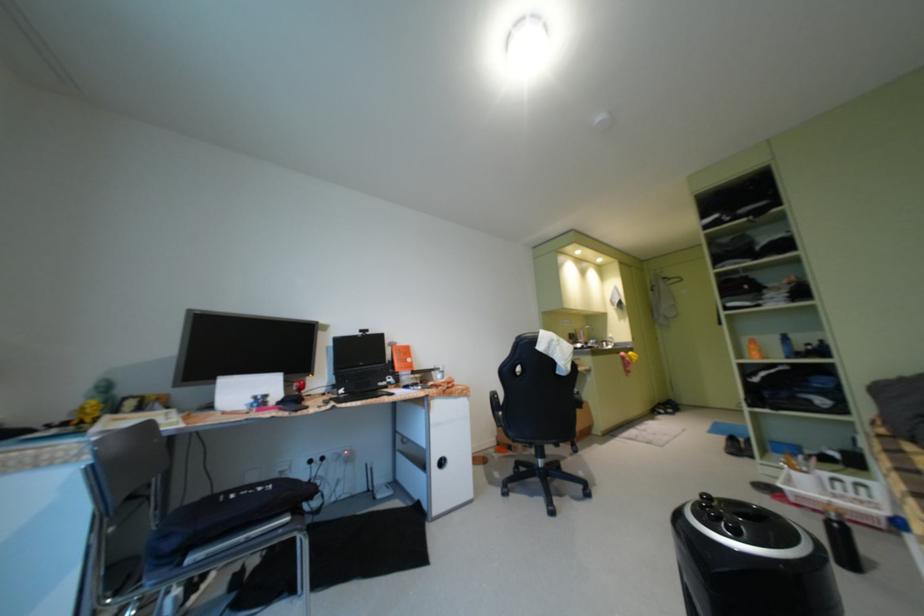
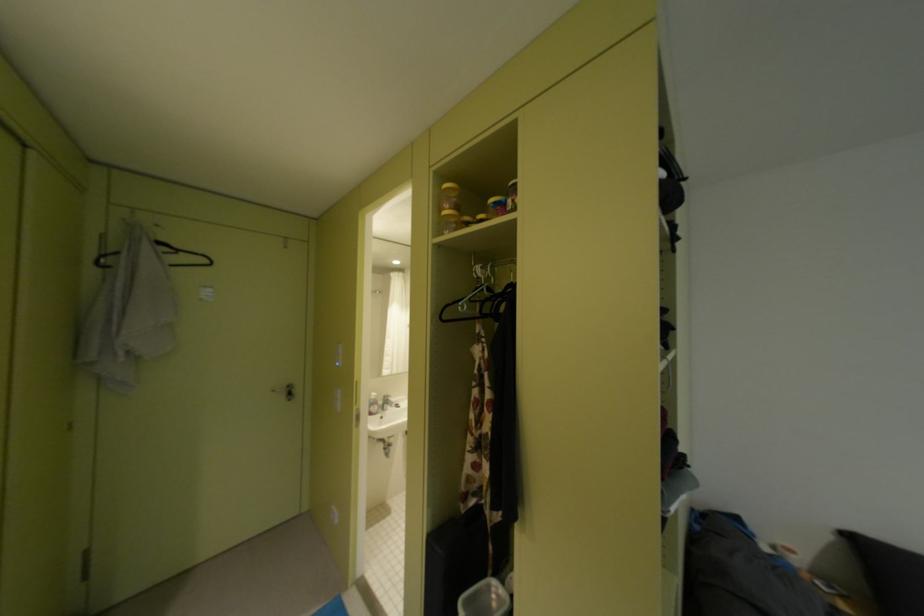
Where in the second image is the point corresponding to point 676,281 from the first image?

(175, 249)